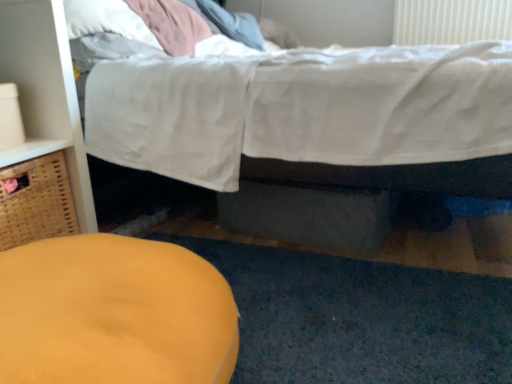
I want to click on matte wood dresser at left, so click(46, 94).

At what (x,y) coordinates should I click in order to perform the action: click on woven brown basket at left. Please return your answer as a coordinate pair (x, y). The height and width of the screenshot is (384, 512). Looking at the image, I should click on (36, 201).

The image size is (512, 384). Describe the element at coordinates (318, 130) in the screenshot. I see `white cotton bed at upper center` at that location.

Locate an element on the screen. white plastic radiator at upper right is located at coordinates coord(451,21).

The width and height of the screenshot is (512, 384). I want to click on matte wood dresser at left, so click(x=46, y=94).

You are a GUI agent. You are given a task and a screenshot of the screen. Output one action in this format:
    pyautogui.click(x=<x>, y=<y>)
    Task: Click on the basket above the matte yellow ottoman at lower left (from the image's perspective)
    
    Given the screenshot: What is the action you would take?
    pyautogui.click(x=36, y=201)

Looking at this image, considering the relative positions of woven brown basket at left and matte yellow ottoman at lower left in the image provided, is woven brown basket at left to the left or to the right of matte yellow ottoman at lower left?

Based on their positions, woven brown basket at left is located to the left of matte yellow ottoman at lower left.

From the image's perspective, is woven brown basket at left located above or below matte yellow ottoman at lower left?

woven brown basket at left is above matte yellow ottoman at lower left.

In the scene shown: Is woven brown basket at left directly adjacent to matte yellow ottoman at lower left?

No, woven brown basket at left is not touching matte yellow ottoman at lower left.

This screenshot has width=512, height=384. What are the coordinates of `bed that appears below the white plastic radiator at upper right (from the image's perspective)` in the screenshot? It's located at (318, 130).

Are white cotton bed at upper center and white plastic radiator at upper right located far from each other?

Yes, white cotton bed at upper center and white plastic radiator at upper right are located far from each other.

Is matte yellow ottoman at lower left facing towards white plastic radiator at upper right?

No, matte yellow ottoman at lower left does not turn towards white plastic radiator at upper right.

Does matte yellow ottoman at lower left have a lesser width compared to white plastic radiator at upper right?

Incorrect, the width of matte yellow ottoman at lower left is not less than that of white plastic radiator at upper right.

From a real-world perspective, between matte yellow ottoman at lower left and white plastic radiator at upper right, who is vertically lower?

From a 3D spatial view, matte yellow ottoman at lower left is below.

Which of these two, matte wood dresser at left or white cotton bed at upper center, is wider?

white cotton bed at upper center.

Relative to white cotton bed at upper center, is matte wood dresser at left in front or behind?

Clearly, matte wood dresser at left is behind white cotton bed at upper center.

Is matte wood dresser at left positioned beyond the bounds of white cotton bed at upper center?

Yes, matte wood dresser at left is located beyond the bounds of white cotton bed at upper center.

Between point (2, 82) and point (226, 41), which one is positioned behind?

Positioned behind is point (226, 41).

From the image's perspective, is white plastic radiator at upper right over matte wood dresser at left?

Yes, from the image's perspective, white plastic radiator at upper right is on top of matte wood dresser at left.

How distant is white plastic radiator at upper right from matte wood dresser at left?

6.62 feet.

At what (x,y) coordinates should I click in order to perform the action: click on dresser below the white plastic radiator at upper right (from the image's perspective). Please return your answer as a coordinate pair (x, y). This screenshot has width=512, height=384. Looking at the image, I should click on (46, 94).

Based on the photo, choose the correct answer: Is white plastic radiator at upper right inside matte wood dresser at left or outside it?

white plastic radiator at upper right exists outside the volume of matte wood dresser at left.

Between woven brown basket at left and white cotton bed at upper center, which one has smaller width?

Thinner between the two is woven brown basket at left.

Is white cotton bed at upper center a part of woven brown basket at left?

No, woven brown basket at left does not contain white cotton bed at upper center.

Considering the points (52, 181) and (332, 228), which point is in front, point (52, 181) or point (332, 228)?

Positioned in front is point (52, 181).

Can you confirm if woven brown basket at left is bigger than white cotton bed at upper center?

No, woven brown basket at left is not bigger than white cotton bed at upper center.

Does point (130, 272) come farther from viewer compared to point (85, 176)?

No, (130, 272) is closer to viewer.

Would you say matte yellow ottoman at lower left contains matte wood dresser at left?

That's incorrect, matte wood dresser at left is not inside matte yellow ottoman at lower left.

This screenshot has height=384, width=512. What are the coordinates of `dresser above the matte yellow ottoman at lower left (from a real-world perspective)` in the screenshot? It's located at (46, 94).

From a real-world perspective, which is physically above, matte yellow ottoman at lower left or matte wood dresser at left?

matte wood dresser at left.

Where is `basket located on the left of matte yellow ottoman at lower left`? The width and height of the screenshot is (512, 384). basket located on the left of matte yellow ottoman at lower left is located at coordinates pos(36,201).

Find the location of `radiator that appears behind the white cotton bed at upper center`. radiator that appears behind the white cotton bed at upper center is located at coordinates (451, 21).

When comparing their distances from white cotton bed at upper center, does white plastic radiator at upper right or matte yellow ottoman at lower left seem closer?

matte yellow ottoman at lower left is positioned closer to the anchor white cotton bed at upper center.

Based on their spatial positions, is white plastic radiator at upper right or white cotton bed at upper center further from matte yellow ottoman at lower left?

Based on the image, white plastic radiator at upper right appears to be further to matte yellow ottoman at lower left.

Considering their positions, is white cotton bed at upper center positioned closer to woven brown basket at left than white plastic radiator at upper right?

white cotton bed at upper center lies closer to woven brown basket at left than the other object.

Looking at the image, which one is located further to matte wood dresser at left, white cotton bed at upper center or woven brown basket at left?

white cotton bed at upper center is further to matte wood dresser at left.

Estimate the real-world distances between objects in this image. Which object is closer to matte wood dresser at left, white plastic radiator at upper right or woven brown basket at left?

woven brown basket at left is positioned closer to the anchor matte wood dresser at left.

Looking at the image, which one is located closer to white cotton bed at upper center, matte yellow ottoman at lower left or matte wood dresser at left?

The object closer to white cotton bed at upper center is matte wood dresser at left.

Considering their positions, is woven brown basket at left positioned further to matte wood dresser at left than white cotton bed at upper center?

white cotton bed at upper center is further to matte wood dresser at left.

When comparing their distances from matte yellow ottoman at lower left, does woven brown basket at left or white plastic radiator at upper right seem closer?

woven brown basket at left is positioned closer to the anchor matte yellow ottoman at lower left.

This screenshot has width=512, height=384. I want to click on furniture located between woven brown basket at left and white cotton bed at upper center in the left-right direction, so click(x=114, y=313).

You are a GUI agent. You are given a task and a screenshot of the screen. Output one action in this format:
    pyautogui.click(x=<x>, y=<y>)
    Task: Click on the dresser between woven brown basket at left and white cotton bed at upper center
    
    Given the screenshot: What is the action you would take?
    pyautogui.click(x=46, y=94)

Locate an element on the screen. dresser positioned between matte yellow ottoman at lower left and woven brown basket at left from near to far is located at coordinates (46, 94).

What are the coordinates of `bed between woven brown basket at left and white plastic radiator at upper right in the horizontal direction` in the screenshot? It's located at (318, 130).